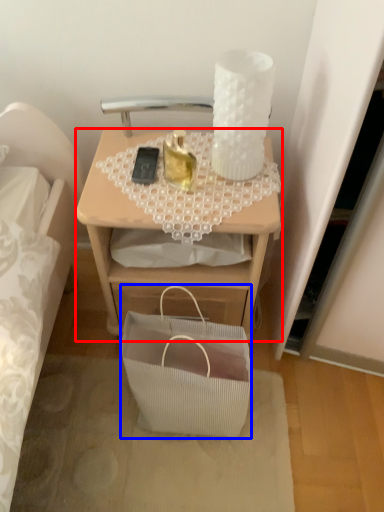
Question: Which object appears farthest to the camera in this image, desk (highlighted by a red box) or handbag (highlighted by a blue box)?

Choices:
 (A) desk
 (B) handbag

Answer: (A)